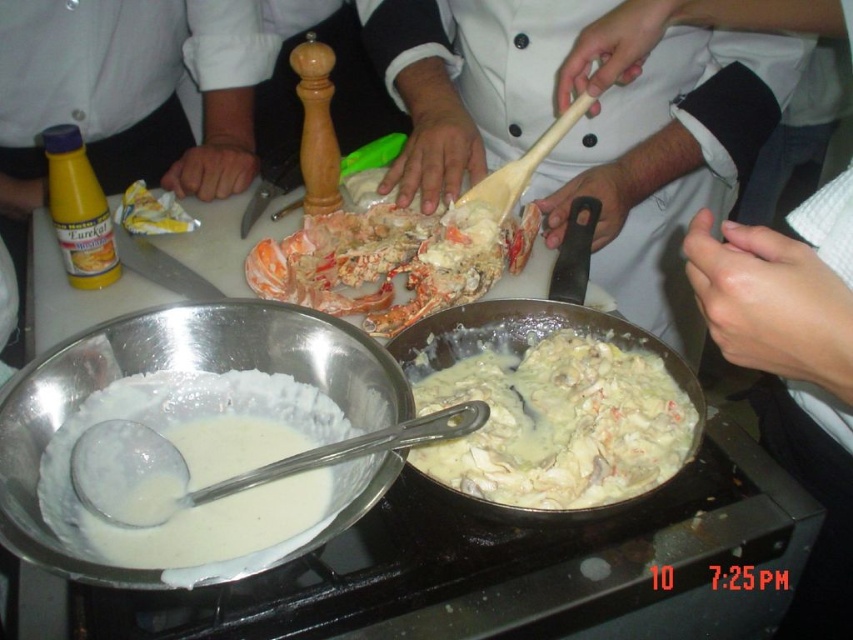
Who is lower down, white creamy sauce at center or white creamy liquid at center?

white creamy liquid at center

The width and height of the screenshot is (853, 640). Identify the location of white creamy sauce at center. (560, 422).

Image resolution: width=853 pixels, height=640 pixels. Find the location of `white creamy sauce at center`. white creamy sauce at center is located at coordinates (560, 422).

Between point (573, 180) and point (347, 259), which one is positioned behind?

The point (573, 180) is behind.

Is point (532, 88) more distant than point (483, 225)?

Yes.

Does point (434, 104) come closer to viewer compared to point (368, 323)?

No.

Image resolution: width=853 pixels, height=640 pixels. In order to click on white glossy lobster at center in this screenshot , I will do `click(668, 163)`.

Does white creamy sauce at center appear under orange shell lobster at center?

Yes.

Is point (665, 392) positioned before point (372, 328)?

Yes, it is.

Is point (672, 429) closer to camera compared to point (306, 282)?

Yes, it is.

Find the location of a particular element. white creamy sauce at center is located at coordinates (560, 422).